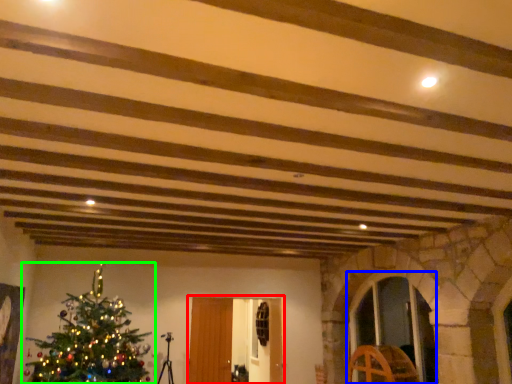
Question: Estimate the real-world distances between objects in this image. Which object is farther from glass door (highlighted by a red box), glass door (highlighted by a blue box) or christmas tree (highlighted by a green box)?

Choices:
 (A) glass door
 (B) christmas tree

Answer: (A)